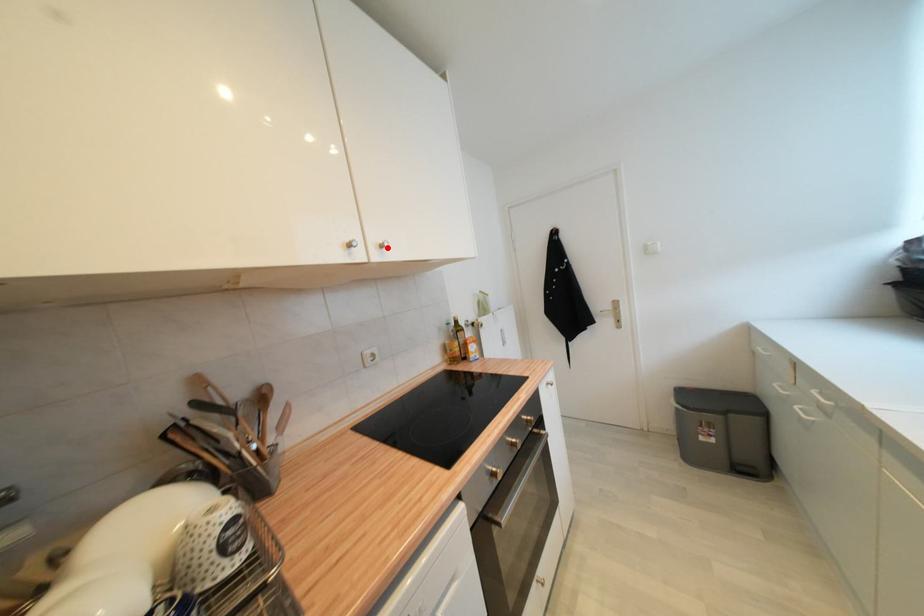
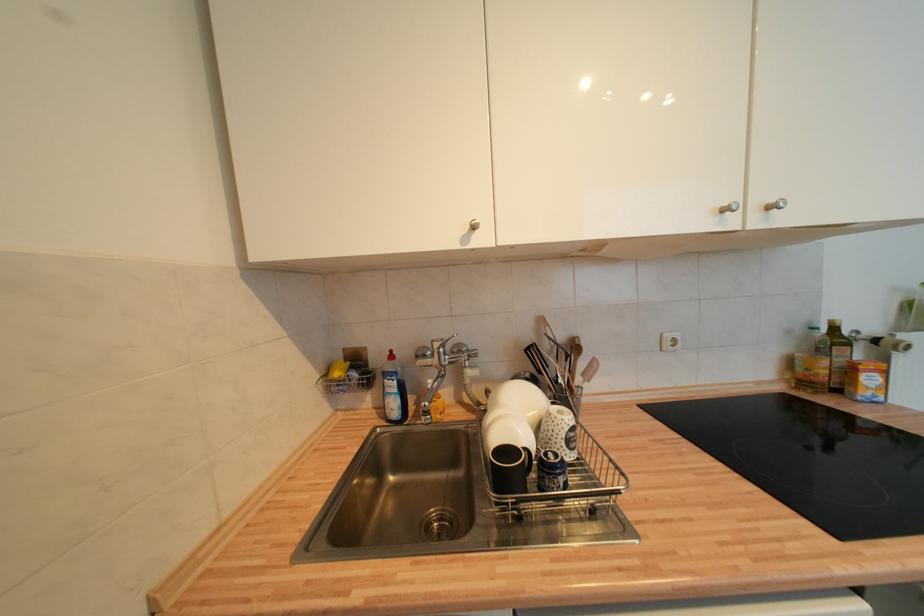
Find the pixel in the second image that matches the highlighted location in the first image.

(775, 209)